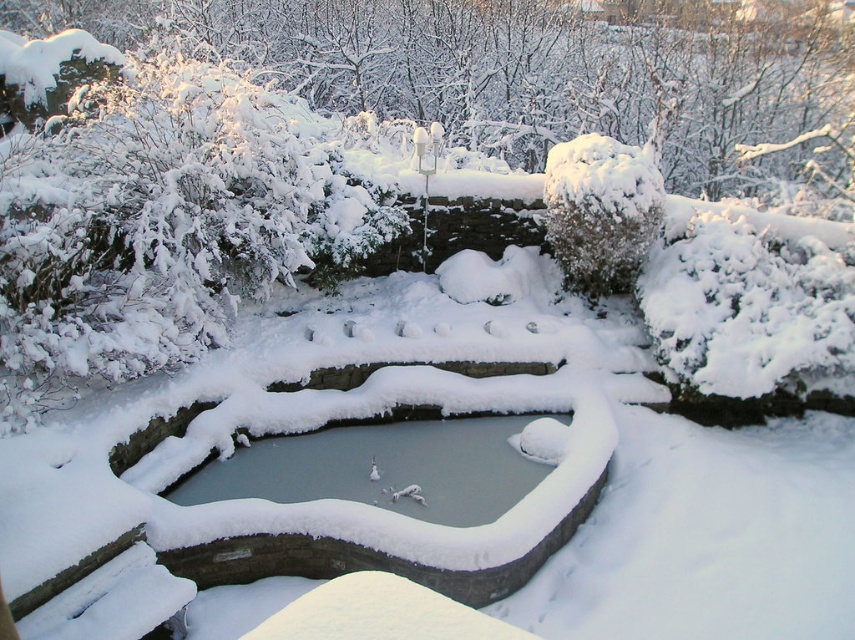
Question: Does white snow-covered tree at upper center have a smaller size compared to clear ice pond at center?

Choices:
 (A) yes
 (B) no

Answer: (B)

Question: Which object is the closest to the clear ice pond at center?

Choices:
 (A) white snow-covered tree at upper center
 (B) white fluffy bush at upper left

Answer: (B)

Question: Where is white fluffy bush at upper left located in relation to clear ice pond at center in the image?

Choices:
 (A) above
 (B) below

Answer: (A)

Question: Can you confirm if white fluffy bush at upper left is bigger than white snow-covered tree at upper center?

Choices:
 (A) no
 (B) yes

Answer: (A)

Question: Which point is closer to the camera?

Choices:
 (A) (738, 61)
 (B) (227, 285)

Answer: (B)

Question: Which point is farther to the camera?

Choices:
 (A) white fluffy bush at upper left
 (B) white snow-covered tree at upper center
 (C) clear ice pond at center

Answer: (B)